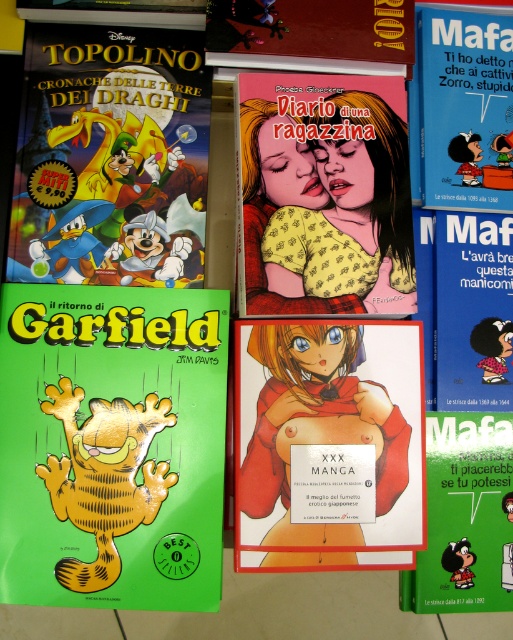
Question: Among these objects, which one is farthest from the camera?

Choices:
 (A) matte red book at upper center
 (B) yellow dotted fabric at center

Answer: (A)

Question: Is green glossy garfield at lower left closer to camera compared to matte green book at upper left?

Choices:
 (A) no
 (B) yes

Answer: (B)

Question: Which of these objects is positioned farthest from the red matte manga at center?

Choices:
 (A) matte yellow garfield at center
 (B) yellow dotted fabric at center
 (C) matte red book at upper center
 (D) green glossy garfield at lower left

Answer: (C)

Question: Which point is closer to the camera?

Choices:
 (A) matte red manga at center
 (B) red matte manga at center
 (C) matte green book at upper left
 (D) yellow dotted fabric at center

Answer: (B)

Question: Can you confirm if matte yellow garfield at center is positioned to the left of matte red manga at center?

Choices:
 (A) no
 (B) yes

Answer: (A)

Question: Does red matte manga at center appear on the right side of matte yellow garfield at center?

Choices:
 (A) yes
 (B) no

Answer: (B)